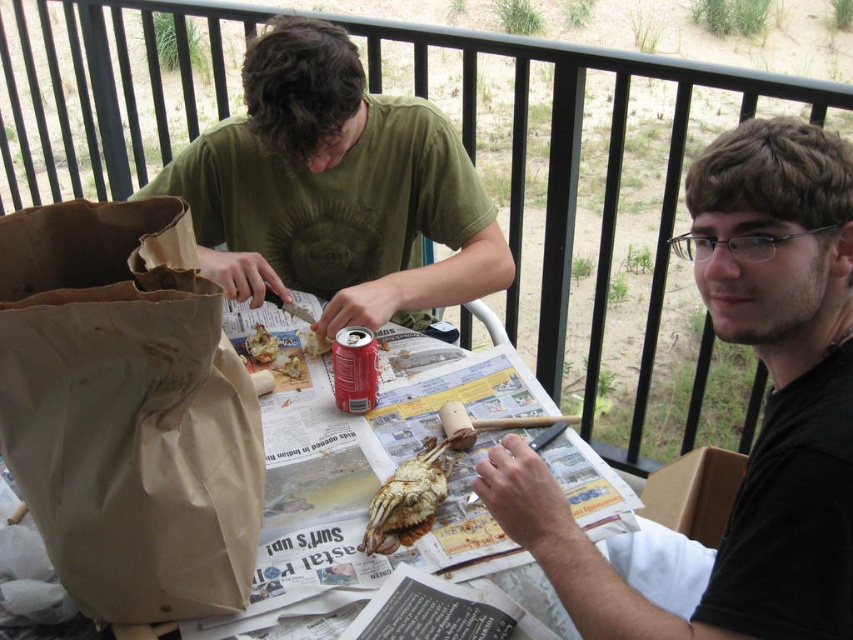
Can you confirm if black matte shirt at upper right is positioned to the right of green matte shirt at upper left?

Correct, you'll find black matte shirt at upper right to the right of green matte shirt at upper left.

Is black matte shirt at upper right wider than green matte shirt at upper left?

Incorrect, black matte shirt at upper right's width does not surpass green matte shirt at upper left's.

Identify the location of black matte shirt at upper right. (762, 420).

The width and height of the screenshot is (853, 640). Identify the location of black matte shirt at upper right. pyautogui.click(x=762, y=420).

Does point (303, 550) lie behind point (345, 356)?

That is False.

Which is behind, point (473, 541) or point (347, 390)?

Point (347, 390)

The image size is (853, 640). I want to click on brown paper bag at center, so click(x=370, y=484).

Does brown paper bag at center appear on the right side of brown纸质螃蟹 at center?

Incorrect, brown paper bag at center is not on the right side of brown纸质螃蟹 at center.

Between point (560, 440) and point (434, 504), which one is positioned behind?

The point (560, 440) is more distant.

This screenshot has height=640, width=853. I want to click on brown paper bag at center, so click(370, 484).